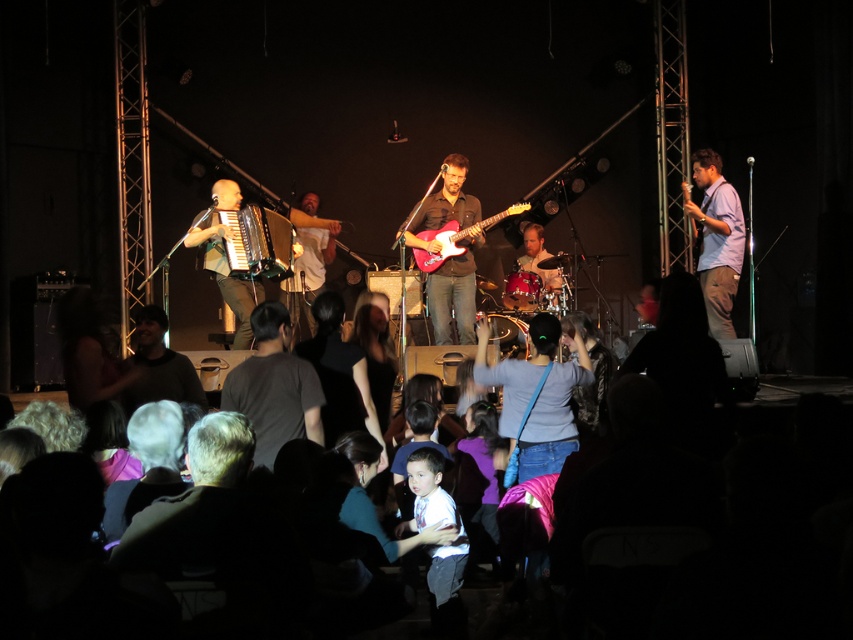
Question: Considering the real-world distances, which object is farthest from the light blue shirt at right?

Choices:
 (A) glossy electric guitar at center
 (B) dark gray t-shirt at center
 (C) matte brown guitar at center

Answer: (B)

Question: Can you confirm if matte brown guitar at center is thinner than shiny black accordion at center-left?

Choices:
 (A) no
 (B) yes

Answer: (A)

Question: Can you confirm if matte brown guitar at center is positioned to the left of matte brown accordion at left?

Choices:
 (A) yes
 (B) no

Answer: (B)

Question: Which point is closer to the camera?

Choices:
 (A) (517, 204)
 (B) (305, 401)
 (C) (238, 292)
 (D) (708, 260)

Answer: (B)

Question: Does light blue shirt at right come behind white t-shirt at center?

Choices:
 (A) yes
 (B) no

Answer: (B)

Question: Which point is closer to the camera?

Choices:
 (A) (239, 218)
 (B) (469, 314)
 (C) (311, 244)

Answer: (A)